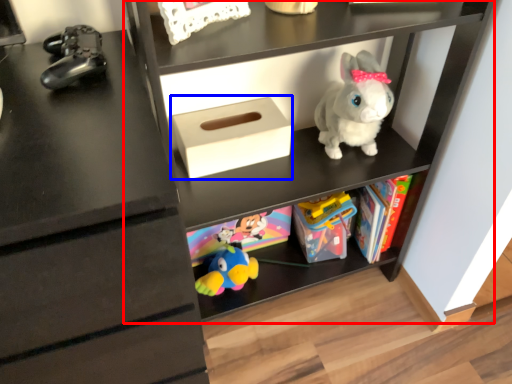
Question: Which of the following is the closest to the observer, shelf (highlighted by a red box) or shoe box (highlighted by a blue box)?

Choices:
 (A) shelf
 (B) shoe box

Answer: (A)